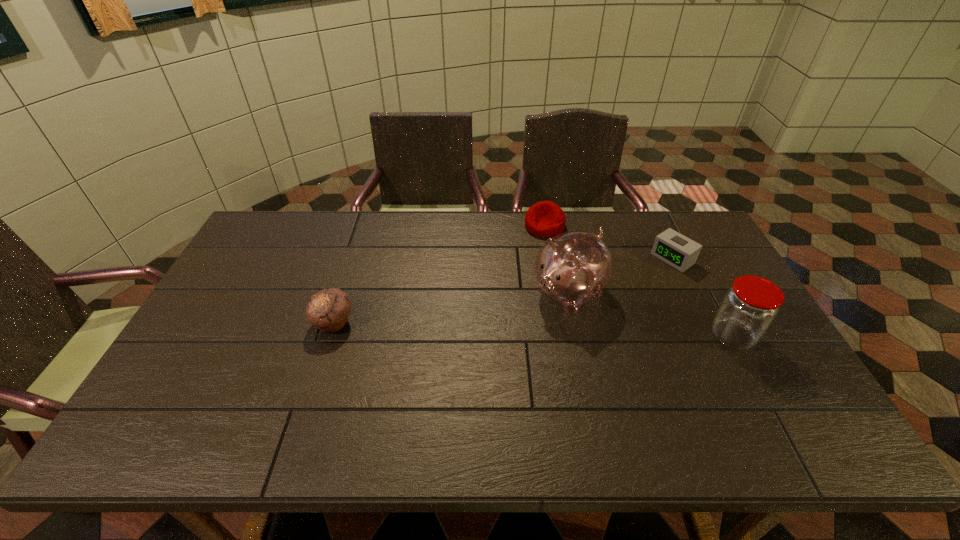
Image resolution: width=960 pixels, height=540 pixels. In order to click on free space between the third shortest object and the fourth shortest object in this screenshot , I will do `click(533, 329)`.

Identify the location of vacant space that's between the piggy bank and the alarm clock. (620, 275).

Find the location of a particular element. vacant space that is in between the alarm clock and the second tallest object is located at coordinates (703, 298).

At what (x,y) coordinates should I click in order to perform the action: click on unoccupied area between the jar and the third tallest object. Please return your answer as a coordinate pair (x, y). Looking at the image, I should click on (533, 329).

The width and height of the screenshot is (960, 540). I want to click on free point between the beanbag and the third tallest object, so click(439, 274).

Where is `vacant region between the fourth shortest object and the beanbag`? vacant region between the fourth shortest object and the beanbag is located at coordinates (638, 281).

Locate an element on the screen. Image resolution: width=960 pixels, height=540 pixels. blank region between the jar and the alarm clock is located at coordinates (703, 298).

Locate which object ranks fourth in proximity to the beanbag. Please provide its 2D coordinates. Your answer should be formatted as a tuple, i.e. [(x, y)], where the tuple contains the x and y coordinates of a point satisfying the conditions above.

[(328, 309)]

Identify which object is located as the third nearest to the farthest object. Please provide its 2D coordinates. Your answer should be formatted as a tuple, i.e. [(x, y)], where the tuple contains the x and y coordinates of a point satisfying the conditions above.

[(748, 309)]

Where is `vacant space that satisfies the following two spatial constraints: 1. on the front side of the tallest object; 2. on the left side of the fourth shortest object`? Image resolution: width=960 pixels, height=540 pixels. vacant space that satisfies the following two spatial constraints: 1. on the front side of the tallest object; 2. on the left side of the fourth shortest object is located at coordinates (578, 336).